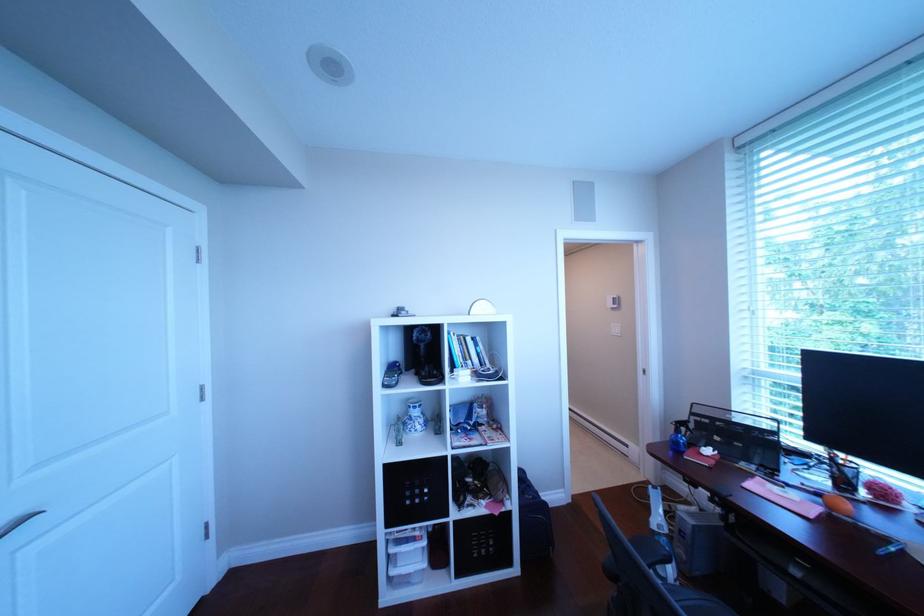
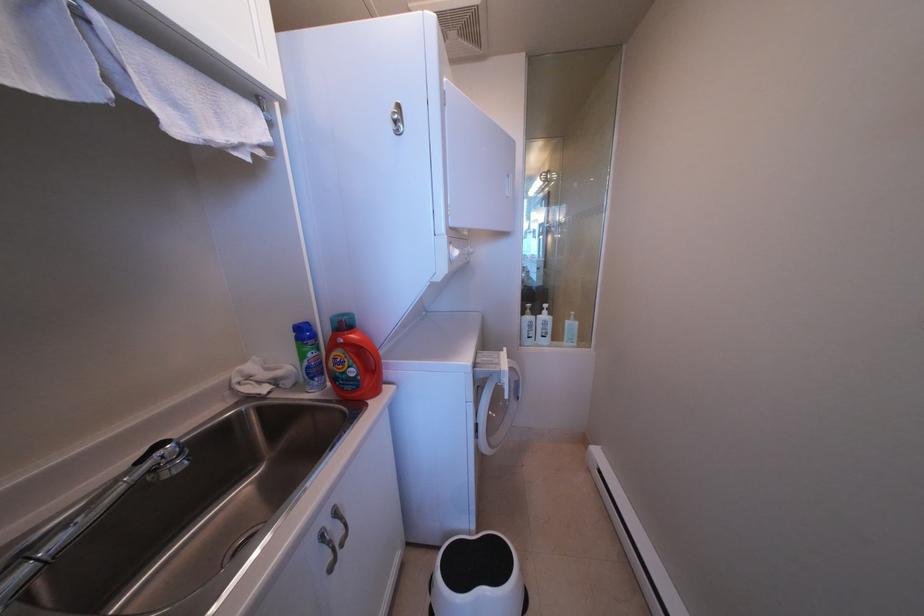
In a continuous first-person perspective shot, in which direction is the camera moving?

The movement direction of the cameraman is right, forward.